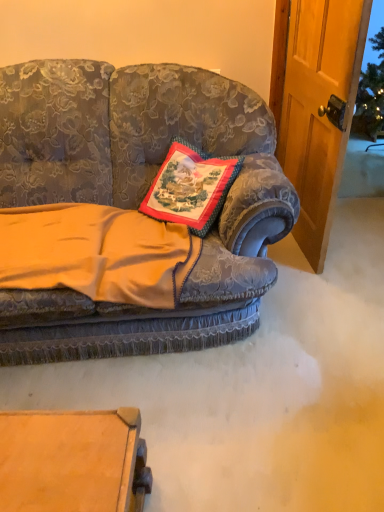
Question: Can you see velvet gold blanket at center touching embroidered fabric pillow at center?

Choices:
 (A) no
 (B) yes

Answer: (A)

Question: Does velvet gold blanket at center have a greater height compared to embroidered fabric pillow at center?

Choices:
 (A) no
 (B) yes

Answer: (A)

Question: Considering the relative sizes of velvet gold blanket at center and embroidered fabric pillow at center in the image provided, is velvet gold blanket at center wider than embroidered fabric pillow at center?

Choices:
 (A) no
 (B) yes

Answer: (B)

Question: Does velvet gold blanket at center have a lesser width compared to embroidered fabric pillow at center?

Choices:
 (A) yes
 (B) no

Answer: (B)

Question: Is velvet gold blanket at center not within embroidered fabric pillow at center?

Choices:
 (A) no
 (B) yes

Answer: (B)

Question: From the image's perspective, is velvet gold blanket at center positioned above or below embroidered fabric pillow at center?

Choices:
 (A) above
 (B) below

Answer: (B)

Question: Is velvet gold blanket at center taller or shorter than embroidered fabric pillow at center?

Choices:
 (A) tall
 (B) short

Answer: (B)

Question: Considering the positions of point (18, 251) and point (185, 221), is point (18, 251) closer or farther from the camera than point (185, 221)?

Choices:
 (A) closer
 (B) farther

Answer: (A)

Question: In the image, is velvet gold blanket at center positioned in front of or behind embroidered fabric pillow at center?

Choices:
 (A) front
 (B) behind

Answer: (A)

Question: From a real-world perspective, is embroidered fabric pillow at center positioned above or below velvet gold blanket at center?

Choices:
 (A) below
 (B) above

Answer: (B)

Question: Is embroidered fabric pillow at center wider or thinner than velvet gold blanket at center?

Choices:
 (A) thin
 (B) wide

Answer: (A)

Question: Is embroidered fabric pillow at center in front of or behind velvet gold blanket at center in the image?

Choices:
 (A) behind
 (B) front

Answer: (A)

Question: Considering the positions of embroidered fabric pillow at center and velvet gold blanket at center in the image, is embroidered fabric pillow at center taller or shorter than velvet gold blanket at center?

Choices:
 (A) short
 (B) tall

Answer: (B)

Question: Does point (69, 275) appear closer or farther from the camera than point (271, 154)?

Choices:
 (A) farther
 (B) closer

Answer: (B)

Question: Considering the relative positions of velvet gold blanket at center and velvet floral couch at center in the image provided, is velvet gold blanket at center to the left or to the right of velvet floral couch at center?

Choices:
 (A) right
 (B) left

Answer: (B)